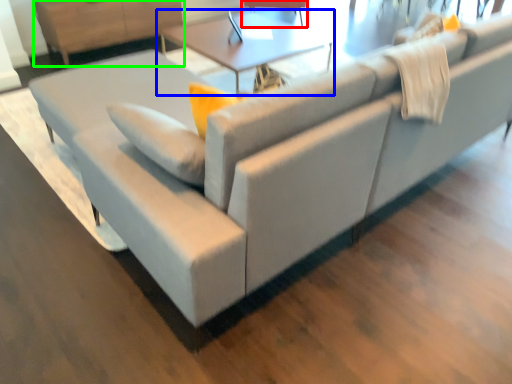
Question: Based on their relative distances, which object is nearer to swivel chair (highlighted by a red box)? Choose from table (highlighted by a blue box) and dresser (highlighted by a green box).

Choices:
 (A) table
 (B) dresser

Answer: (A)